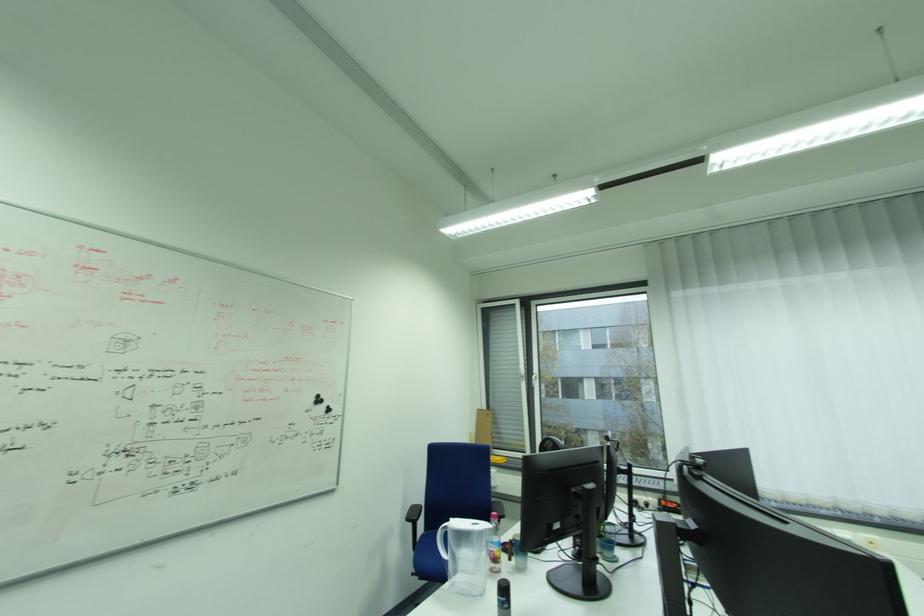
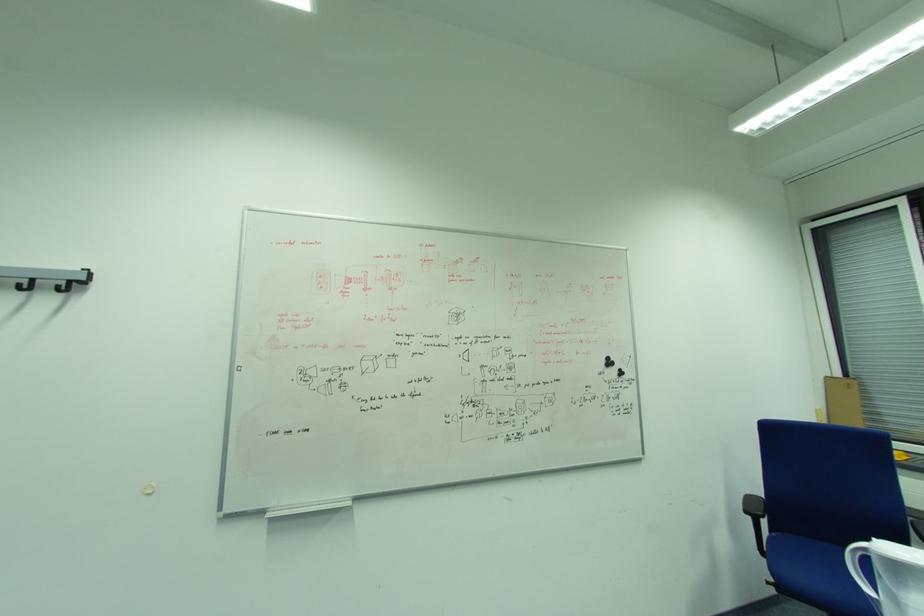
The point at (451, 556) is marked in the first image. Where is the corresponding point in the second image?

(876, 591)